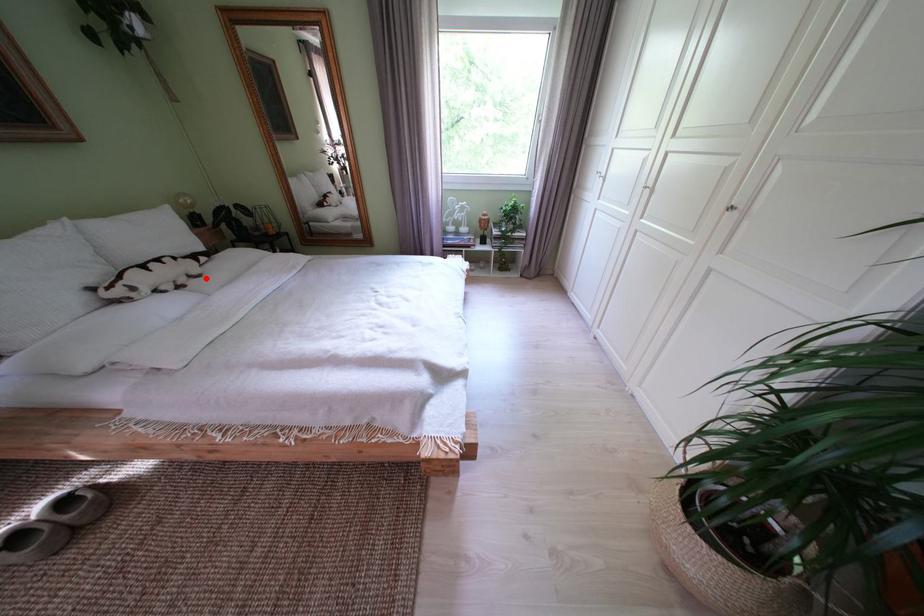
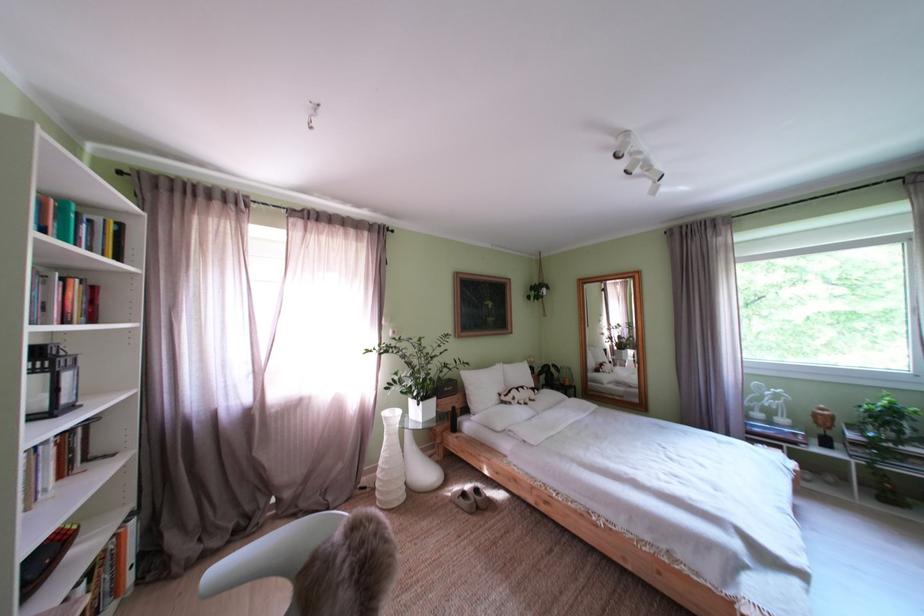
Question: I am providing you with two images of the same scene from different viewpoints. A red point is shown in image1. For the corresponding object point in image2, is it positioned nearer or farther from the camera?

Choices:
 (A) Nearer
 (B) Farther

Answer: (B)